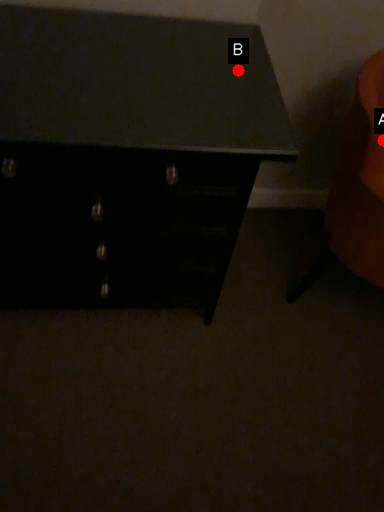
Question: Two points are circled on the image, labeled by A and B beside each circle. Which point is closer to the camera taking this photo?

Choices:
 (A) A is closer
 (B) B is closer

Answer: (B)